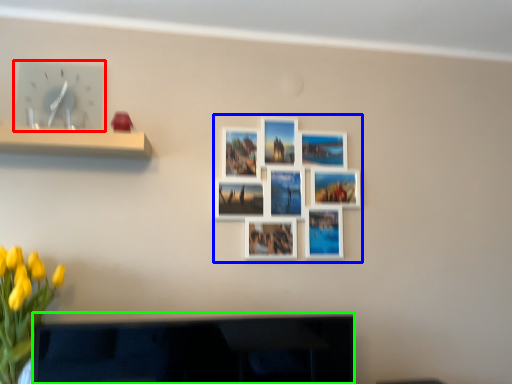
Question: Which object is the closest to the clock (highlighted by a red box)? Choose among these: decorative picture (highlighted by a blue box) or television (highlighted by a green box).

Choices:
 (A) decorative picture
 (B) television

Answer: (A)